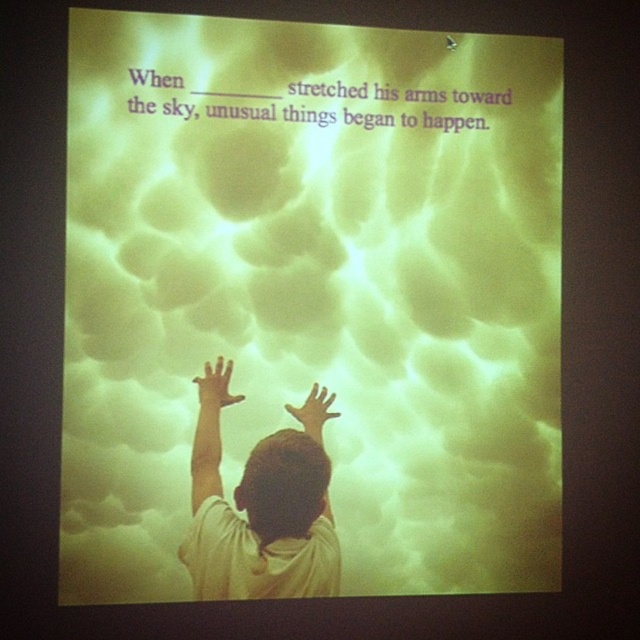
You are an observer standing in front of the scene. You see the white matte shirt at lower center and the matte yellow hand at upper center. Which object is positioned higher in the image?

The matte yellow hand at upper center is positioned higher than the white matte shirt at lower center.

The scene shows a person with their arms raised. There is a point labeled at coordinates (216,385). What object is located at that point?

The point at (216,385) indicates a matte yellow hand at upper center.

You are an observer standing in front of the image. You notice the white matte shirt at lower center and the matte yellow hand at center. Which object is positioned closer to you?

The white matte shirt at lower center is closer to the viewer than the matte yellow hand at center.